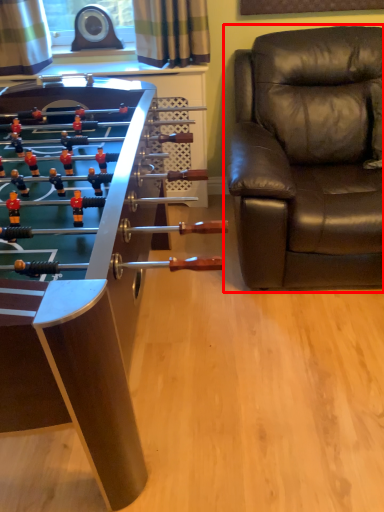
Question: From the image's perspective, what is the correct spatial relationship of chair (annotated by the red box) in relation to table?

Choices:
 (A) above
 (B) below

Answer: (A)